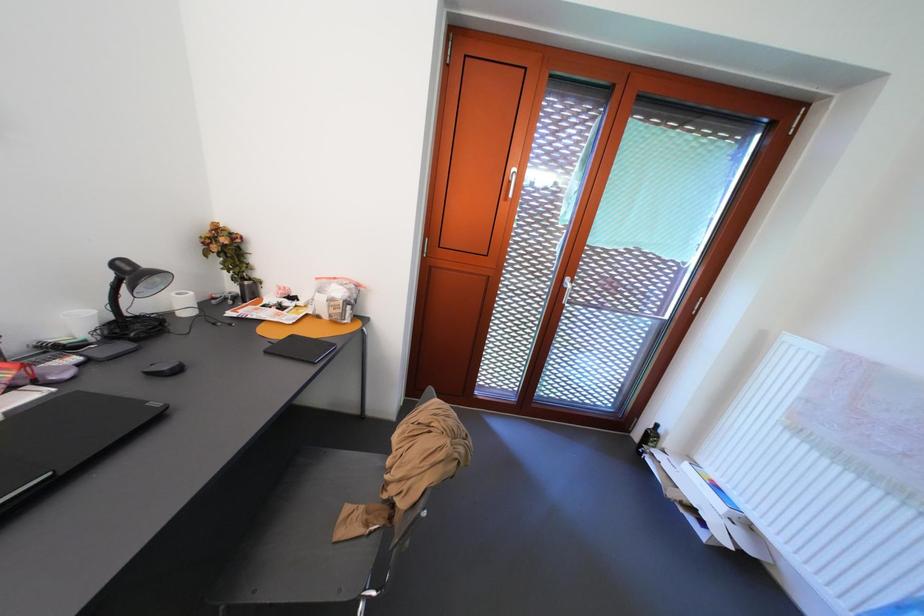
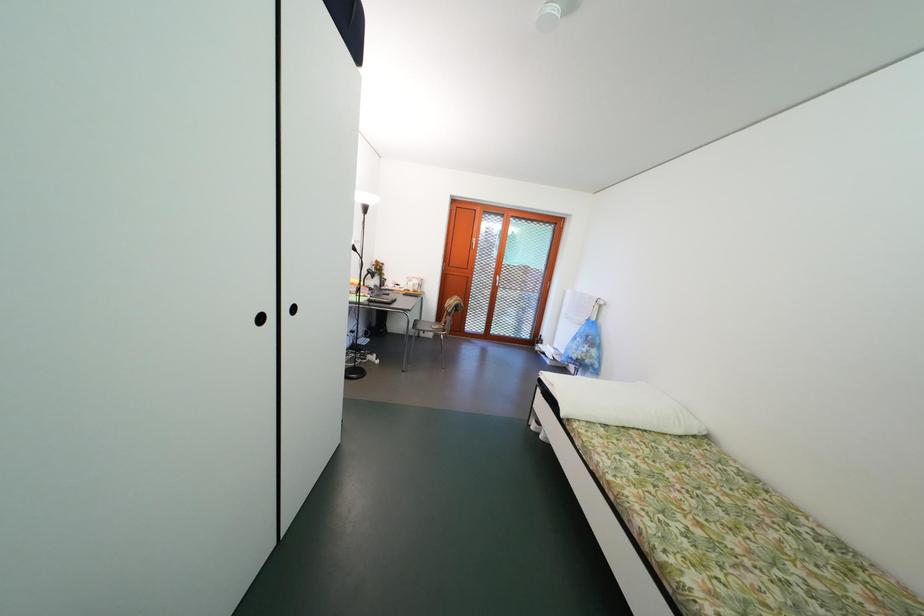
Question: What movement of the cameraman would produce the second image?

Choices:
 (A) Left
 (B) Right
 (C) Forward
 (D) Backward

Answer: (D)